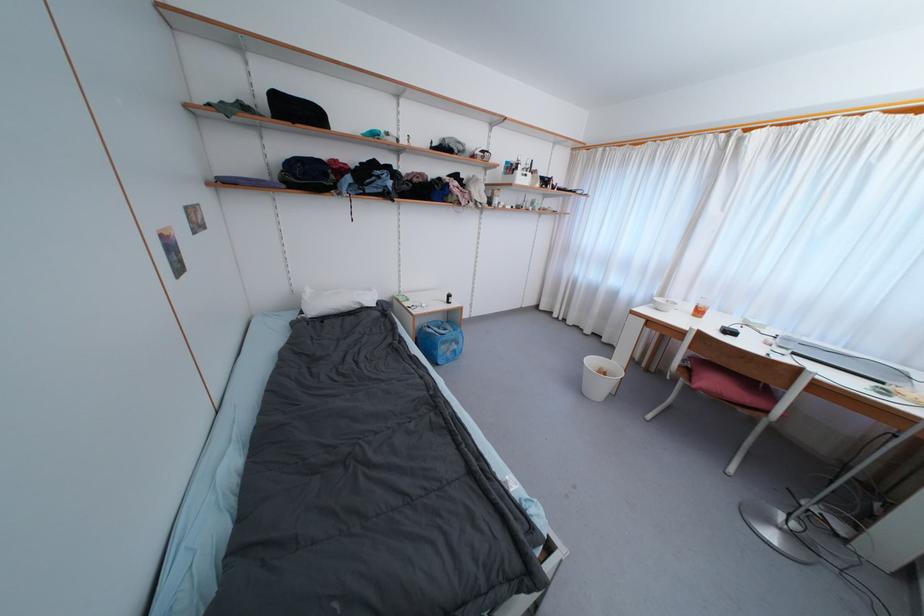
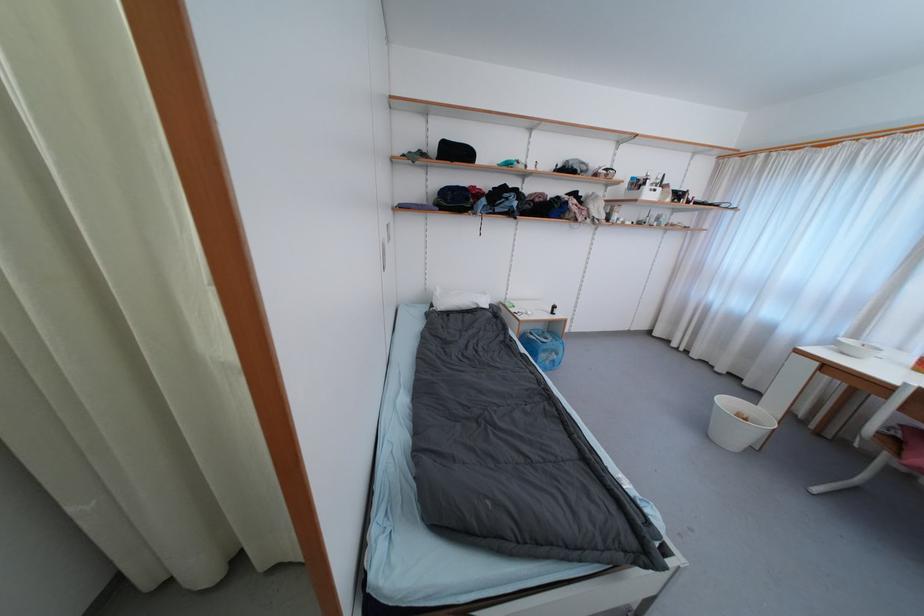
Find the pixel in the second image that matches [596,363] in the first image.

(732, 405)